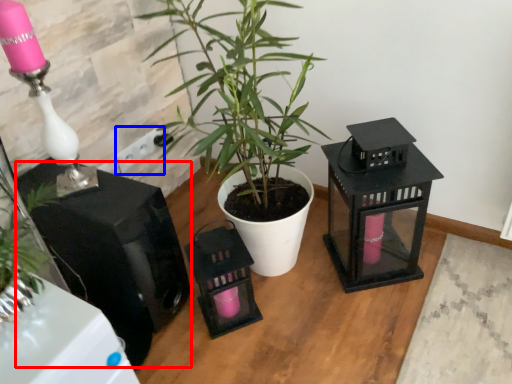
Question: Which object is further to the camera taking this photo, appliance (highlighted by a red box) or electric outlet (highlighted by a blue box)?

Choices:
 (A) appliance
 (B) electric outlet

Answer: (B)